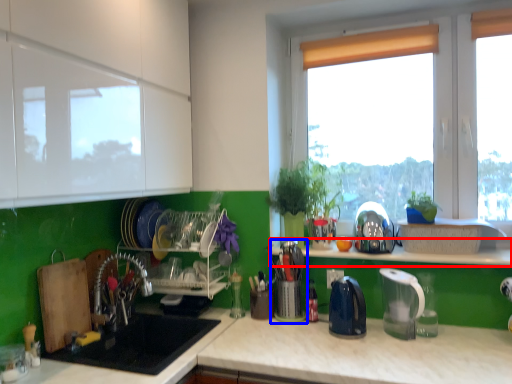
Question: Which of the following is the farthest to the observer, window sill (highlighted by a red box) or appliance (highlighted by a blue box)?

Choices:
 (A) window sill
 (B) appliance

Answer: (B)